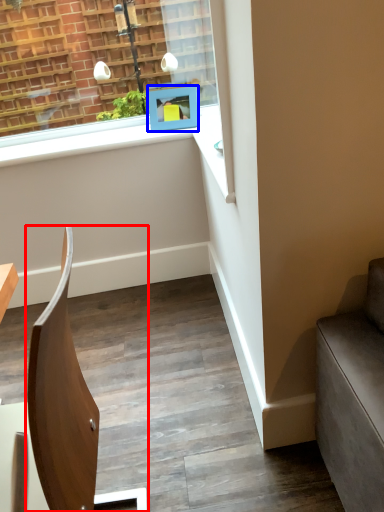
Question: Which point is further to the camera, chair (highlighted by a red box) or picture frame (highlighted by a blue box)?

Choices:
 (A) chair
 (B) picture frame

Answer: (B)